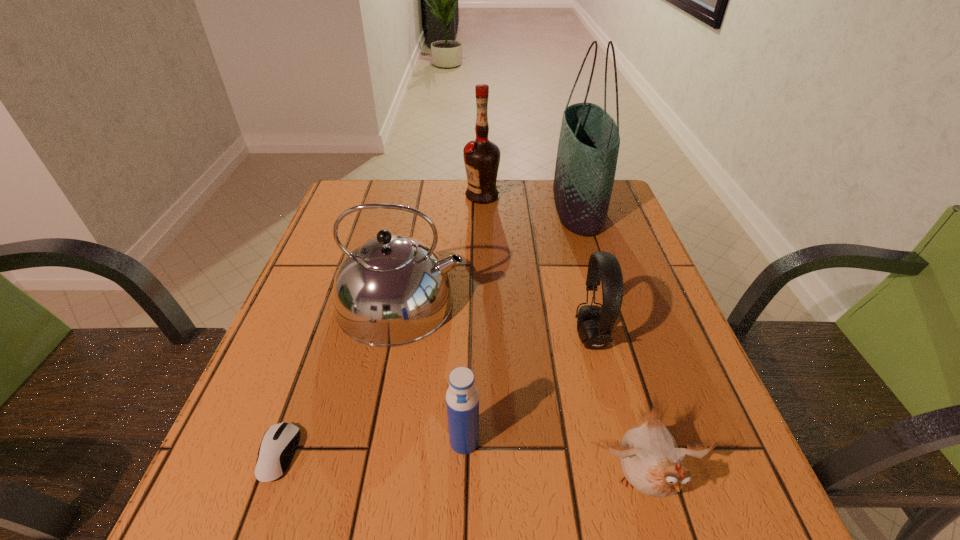
Locate an element on the screen. The image size is (960, 540). blank space located 0.230m on the front and back of the sixth shortest object is located at coordinates (386, 196).

This screenshot has width=960, height=540. I want to click on free region located 0.170m from the spout of the third tallest object, so click(543, 302).

The width and height of the screenshot is (960, 540). What are the coordinates of `free spot located on the front-facing side of the headset` in the screenshot? It's located at (401, 337).

You are a GUI agent. You are given a task and a screenshot of the screen. Output one action in this format:
    pyautogui.click(x=<x>, y=<y>)
    Task: Click on the free space located 0.300m on the front-facing side of the headset
    
    Given the screenshot: What is the action you would take?
    pyautogui.click(x=426, y=337)

The width and height of the screenshot is (960, 540). I want to click on free space located 0.350m on the front-facing side of the headset, so click(x=401, y=337).

Locate an element on the screen. vacant space situated 0.220m on the back of the water bottle is located at coordinates (468, 329).

Find the location of a particular element. The height and width of the screenshot is (540, 960). vacant area located on the right of the mouse is located at coordinates (453, 454).

Find the location of a particular element. Image resolution: width=960 pixels, height=540 pixels. tote bag at the far edge is located at coordinates (589, 140).

At what (x,y) coordinates should I click in order to perform the action: click on liquor present at the far edge. Please return your answer as a coordinate pair (x, y). Image resolution: width=960 pixels, height=540 pixels. Looking at the image, I should click on (481, 157).

This screenshot has height=540, width=960. I want to click on bird positioned at the near edge, so tap(652, 463).